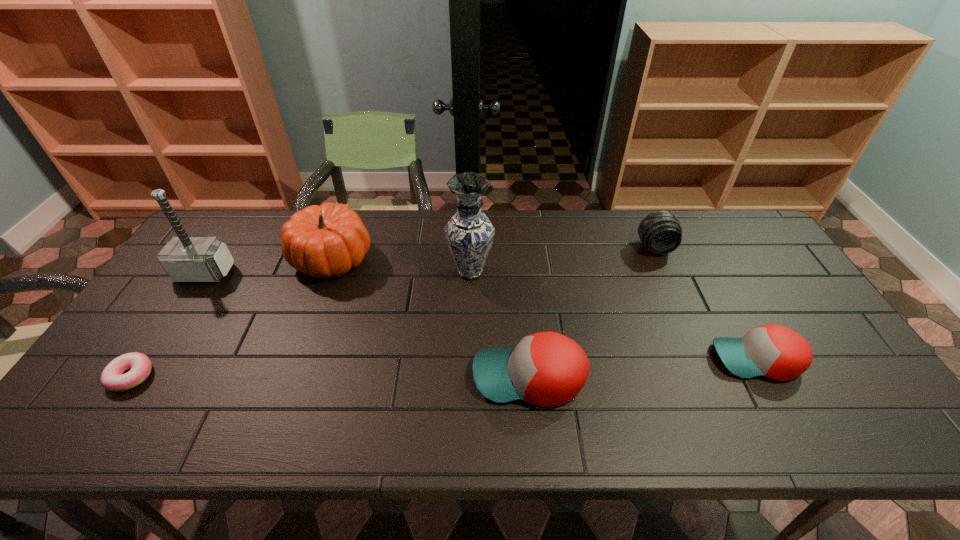
Please show where to add a baseball cap on the left while keeping spacing even. Please provide its 2D coordinates. Your answer should be formatted as a tuple, i.e. [(x, y)], where the tuple contains the x and y coordinates of a point satisfying the conditions above.

[(285, 396)]